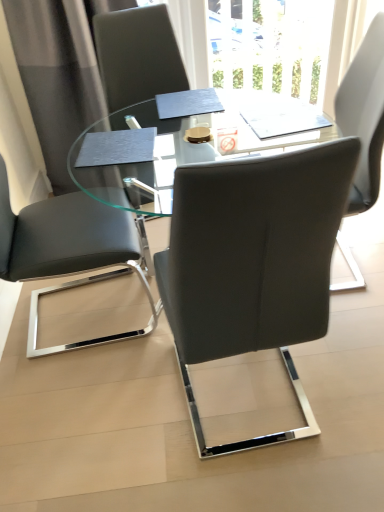
Question: Does point (39, 5) appear closer or farther from the camera than point (125, 258)?

Choices:
 (A) closer
 (B) farther

Answer: (B)

Question: From their relative heights in the image, would you say gray fabric curtain at upper left is taller or shorter than matte black chair at left, acting as the 2th chair starting from the right?

Choices:
 (A) short
 (B) tall

Answer: (B)

Question: Estimate the real-world distances between objects in this image. Which object is farther from the matte black chair at left, the 1th chair when ordered from left to right?

Choices:
 (A) transparent glass table at center
 (B) matte gray chair at center, which is the 1th chair from right to left
 (C) gray fabric curtain at upper left

Answer: (C)

Question: Which is farther from the matte black chair at left, acting as the 2th chair starting from the right?

Choices:
 (A) transparent glass table at center
 (B) matte gray chair at center, which is the 1th chair from right to left
 (C) gray fabric curtain at upper left

Answer: (C)